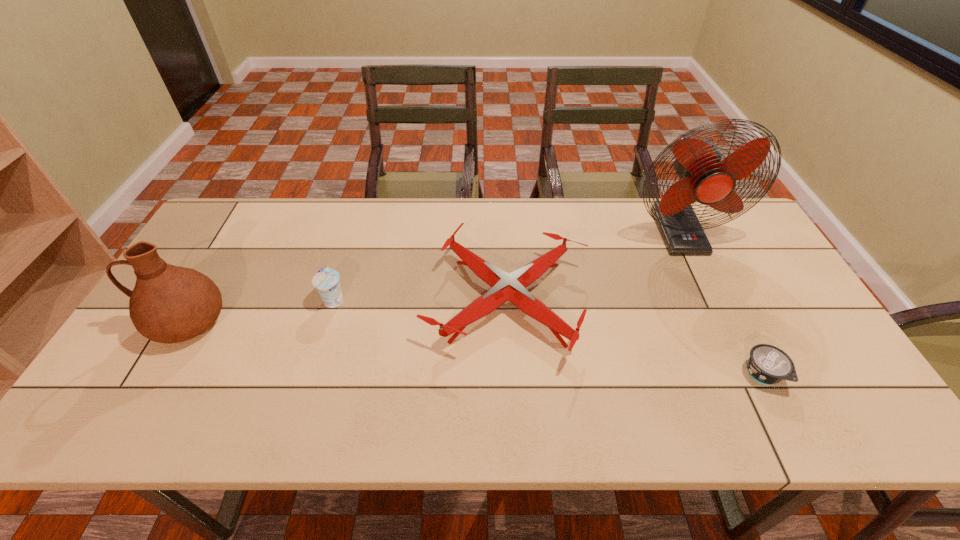
At what (x,y) coordinates should I click in order to perform the action: click on free location at the right edge of the desktop. Please return your answer as a coordinate pair (x, y). The width and height of the screenshot is (960, 540). Looking at the image, I should click on (721, 264).

Locate an element on the screen. The image size is (960, 540). blank space at the far right corner of the desktop is located at coordinates (724, 237).

At what (x,y) coordinates should I click in order to perform the action: click on free area in between the shortest object and the tallest object. Please return your answer as a coordinate pair (x, y). Looking at the image, I should click on (721, 303).

Where is `empty location between the third object from right to left and the nearer yogurt`? Image resolution: width=960 pixels, height=540 pixels. empty location between the third object from right to left and the nearer yogurt is located at coordinates (635, 338).

Identify the location of free spot between the taller yogurt and the right yogurt. Image resolution: width=960 pixels, height=540 pixels. (548, 338).

Image resolution: width=960 pixels, height=540 pixels. I want to click on free space that is in between the nearer yogurt and the leftmost object, so click(475, 349).

Where is `vacant area that lies between the fan and the shorter yogurt`? vacant area that lies between the fan and the shorter yogurt is located at coordinates (721, 303).

What are the coordinates of `free space between the drone and the farther yogurt` in the screenshot? It's located at (420, 300).

This screenshot has height=540, width=960. Identify the location of empty space that is in between the pitcher and the fourth object from right to left. (261, 311).

You are a GUI agent. You are given a task and a screenshot of the screen. Output one action in this format:
    pyautogui.click(x=<x>, y=<y>)
    Task: Click on the free point between the tallest object and the pitcher
    
    Given the screenshot: What is the action you would take?
    pyautogui.click(x=433, y=278)